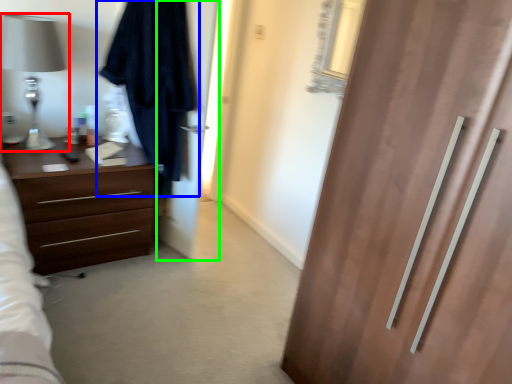
Question: Which object is the farthest from table lamp (highlighted by a red box)? Choose among these: robe (highlighted by a blue box) or screen door (highlighted by a green box).

Choices:
 (A) robe
 (B) screen door

Answer: (B)